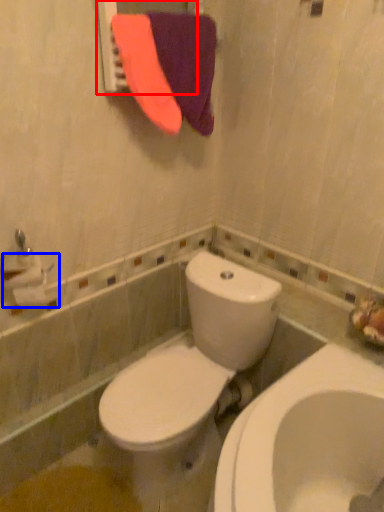
Question: Which object appears farthest to the camera in this image, mirror (highlighted by a red box) or toilet paper (highlighted by a blue box)?

Choices:
 (A) mirror
 (B) toilet paper

Answer: (B)